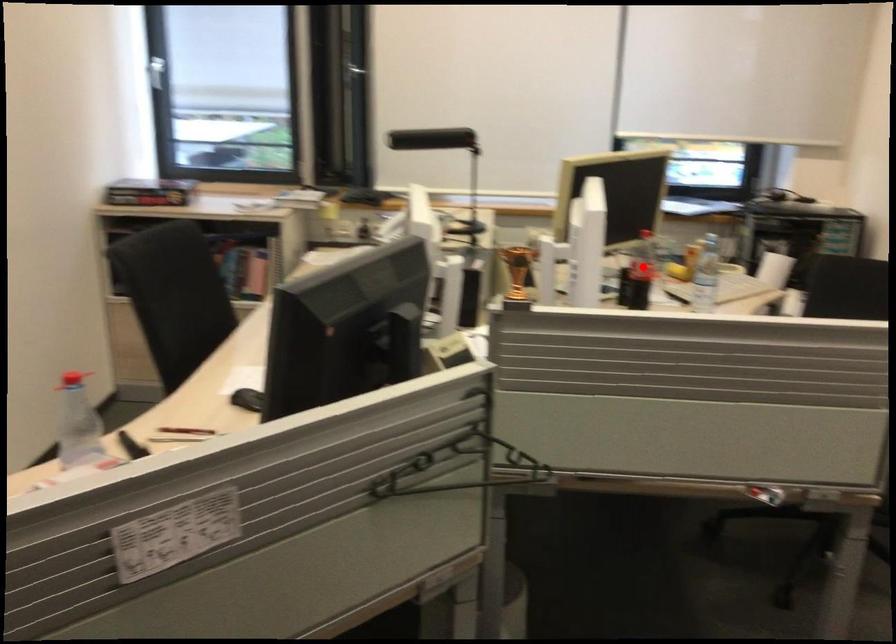
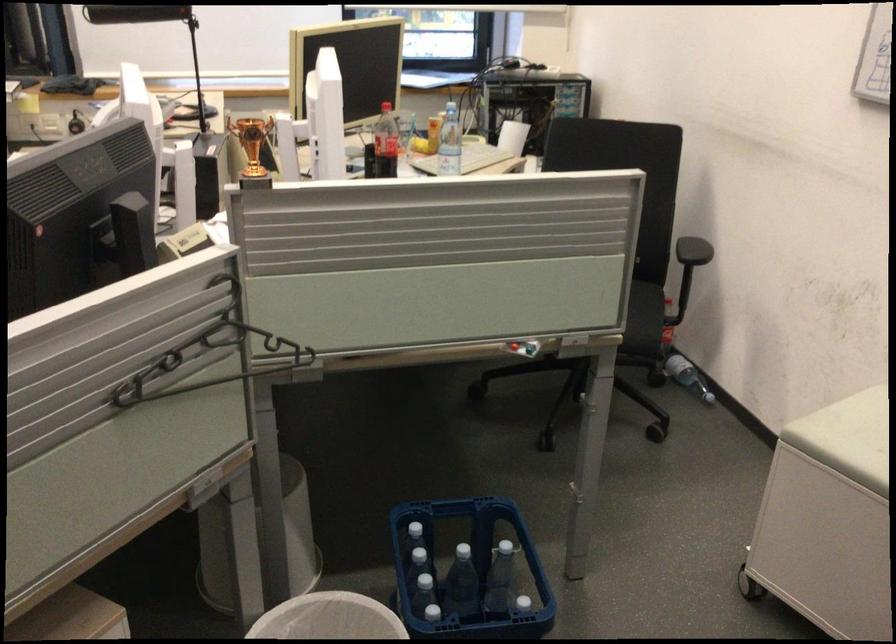
Find the pixel in the second image that matches the highlighted location in the first image.

(385, 143)